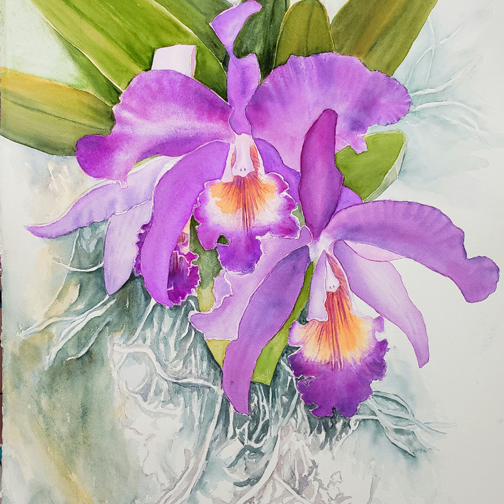
Find the location of a particular element. Image resolution: width=504 pixels, height=504 pixels. paint is located at coordinates (64, 461), (88, 398).